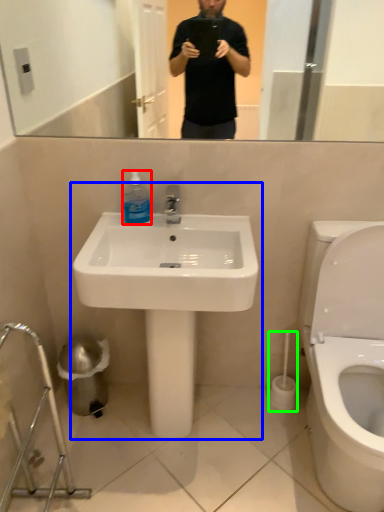
Question: Which object is the farthest from cleaning product (highlighted by a red box)? Choose among these: sink (highlighted by a blue box) or brush (highlighted by a green box).

Choices:
 (A) sink
 (B) brush

Answer: (B)